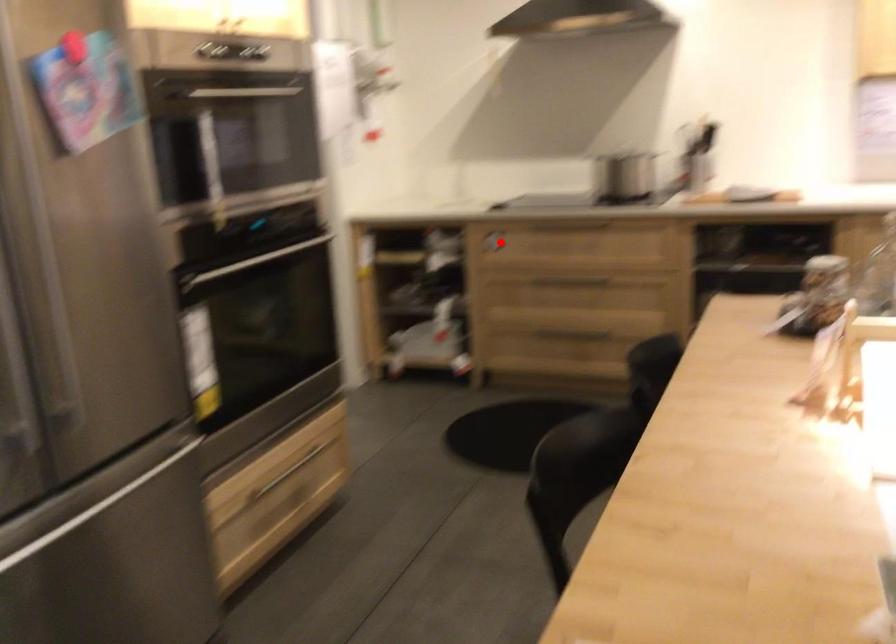
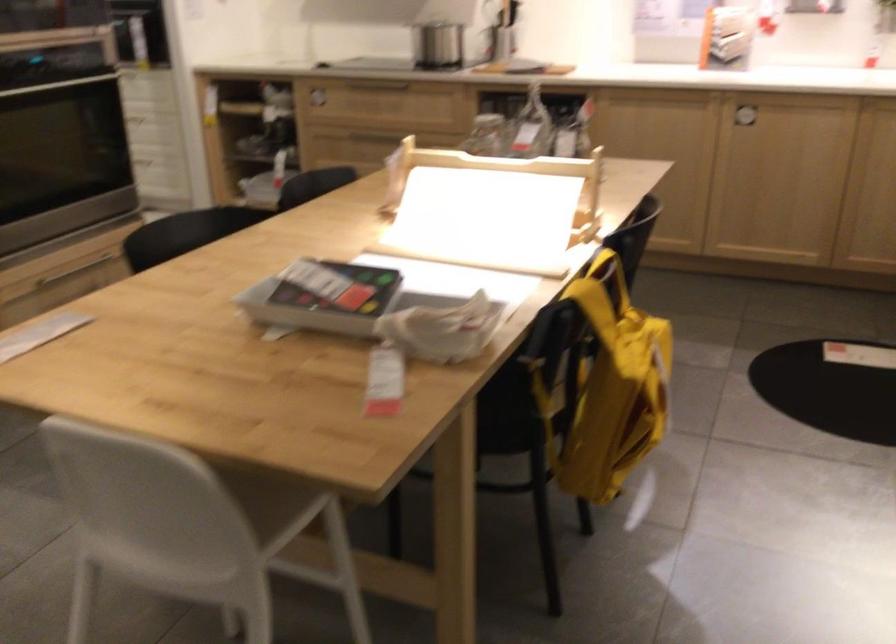
Question: I am providing you with two images of the same scene from different viewpoints. Given a red point in image1, look at the same physical point in image2. Is it:

Choices:
 (A) Closer to the viewpoint
 (B) Farther from the viewpoint

Answer: (B)